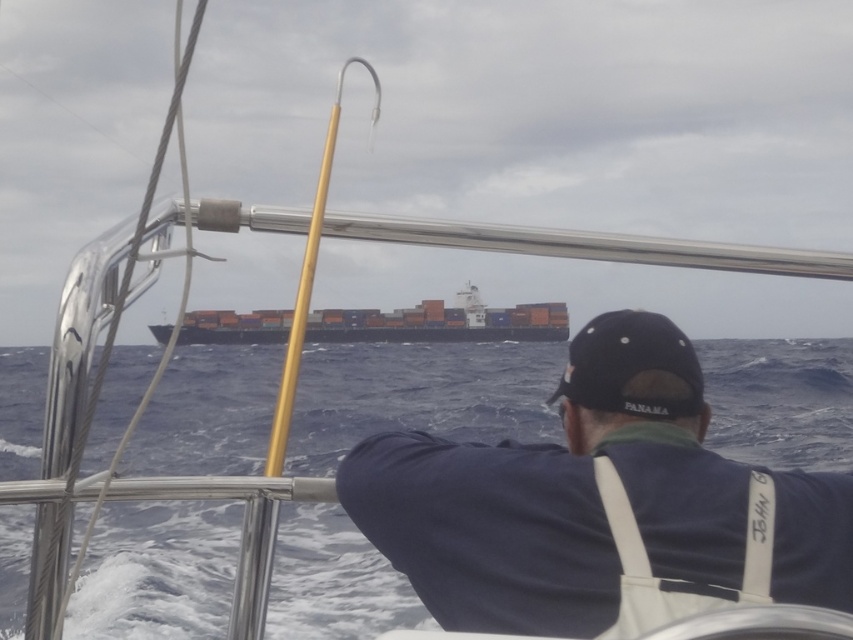
Question: Which object is farther from the camera taking this photo?

Choices:
 (A) orange matte container ship at center
 (B) blue water at center

Answer: (A)

Question: Which object is closer to the camera taking this photo?

Choices:
 (A) blue water at center
 (B) orange matte container ship at center

Answer: (A)

Question: Is blue water at center thinner than orange matte container ship at center?

Choices:
 (A) no
 (B) yes

Answer: (A)

Question: Observing the image, what is the correct spatial positioning of blue water at center in reference to orange matte container ship at center?

Choices:
 (A) above
 (B) below

Answer: (B)

Question: Is blue water at center positioned at the back of orange matte container ship at center?

Choices:
 (A) yes
 (B) no

Answer: (B)